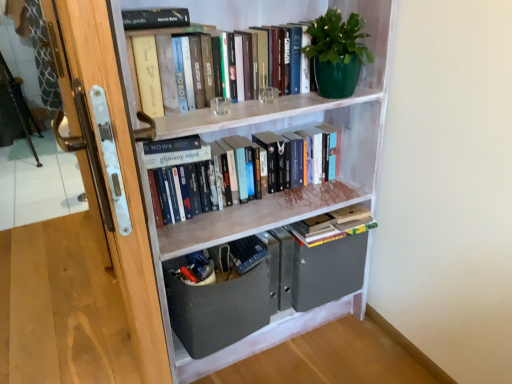
Question: Is white painted wood bookcase at upper center taller or shorter than hardcover books at upper center, arranged as the 3th book when ordered from the bottom?

Choices:
 (A) tall
 (B) short

Answer: (A)

Question: Is white painted wood bookcase at upper center situated inside hardcover books at upper center, arranged as the 3th book when ordered from the bottom, or outside?

Choices:
 (A) outside
 (B) inside

Answer: (A)

Question: Estimate the real-world distances between objects in this image. Which object is closer to the wooden door handle at left?

Choices:
 (A) matte gray drawer at lower center
 (B) green matte pot at upper right
 (C) hardcover books at upper center, which is the first book from top to bottom
 (D) white painted wood bookcase at upper center
 (E) hardcover books at center, placed as the 2th book when sorted from top to bottom

Answer: (A)

Question: Which object is positioned farthest from the hardcover books at upper center, arranged as the 3th book when ordered from the bottom?

Choices:
 (A) white painted wood bookcase at upper center
 (B) matte gray drawer at lower center
 (C) wooden book at center, acting as the first book starting from the bottom
 (D) green matte pot at upper right
 (E) hardcover books at center, positioned as the 2th book in bottom-to-top order

Answer: (B)